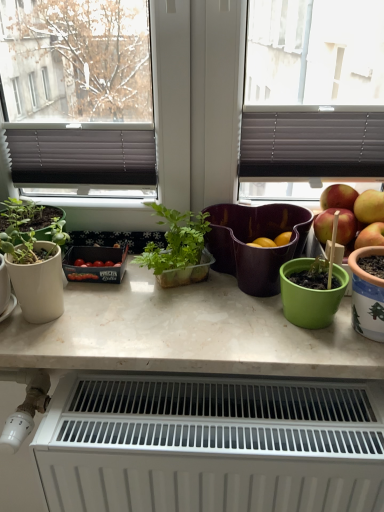
Question: Is matte purple flowerpot at center, positioned as the first flowerpot in left-to-right order, closer to the viewer compared to white matte radiator at lower center?

Choices:
 (A) no
 (B) yes

Answer: (A)

Question: Can we say matte purple flowerpot at center, arranged as the first flowerpot when viewed from the back, lies outside white matte radiator at lower center?

Choices:
 (A) no
 (B) yes

Answer: (B)

Question: Is matte purple flowerpot at center, arranged as the first flowerpot when viewed from the back, behind white matte radiator at lower center?

Choices:
 (A) yes
 (B) no

Answer: (A)

Question: Does matte purple flowerpot at center, positioned as the first flowerpot in left-to-right order, have a greater height compared to white matte radiator at lower center?

Choices:
 (A) yes
 (B) no

Answer: (B)

Question: Is matte purple flowerpot at center, the 2th flowerpot in the right-to-left sequence, beside white matte radiator at lower center?

Choices:
 (A) no
 (B) yes

Answer: (A)

Question: From the image's perspective, is translucent plastic plant at center located above or below white marble countertop at center?

Choices:
 (A) below
 (B) above

Answer: (B)

Question: Does point (175, 285) appear closer or farther from the camera than point (370, 357)?

Choices:
 (A) farther
 (B) closer

Answer: (A)

Question: Is translucent plastic plant at center inside the boundaries of white marble countertop at center, or outside?

Choices:
 (A) inside
 (B) outside

Answer: (B)

Question: In the image, is translucent plastic plant at center positioned in front of or behind white marble countertop at center?

Choices:
 (A) front
 (B) behind

Answer: (B)

Question: Which is correct: white ceramic pot at right, arranged as the 2th flowerpot when viewed from the left, is inside white matte radiator at lower center, or outside of it?

Choices:
 (A) inside
 (B) outside

Answer: (B)

Question: Looking at the image, does white ceramic pot at right, acting as the 1th flowerpot starting from the front, seem bigger or smaller compared to white matte radiator at lower center?

Choices:
 (A) small
 (B) big

Answer: (A)

Question: Is white ceramic pot at right, which is the second flowerpot from back to front, taller or shorter than white matte radiator at lower center?

Choices:
 (A) tall
 (B) short

Answer: (B)

Question: Considering the positions of white ceramic pot at right, marked as the 1th flowerpot in a right-to-left arrangement, and white matte radiator at lower center in the image, is white ceramic pot at right, marked as the 1th flowerpot in a right-to-left arrangement, wider or thinner than white matte radiator at lower center?

Choices:
 (A) thin
 (B) wide

Answer: (A)

Question: From a real-world perspective, is white matte radiator at lower center physically located above or below translucent plastic plant at center?

Choices:
 (A) above
 (B) below

Answer: (B)

Question: Based on their positions, is white matte radiator at lower center located to the left or right of translucent plastic plant at center?

Choices:
 (A) right
 (B) left

Answer: (A)